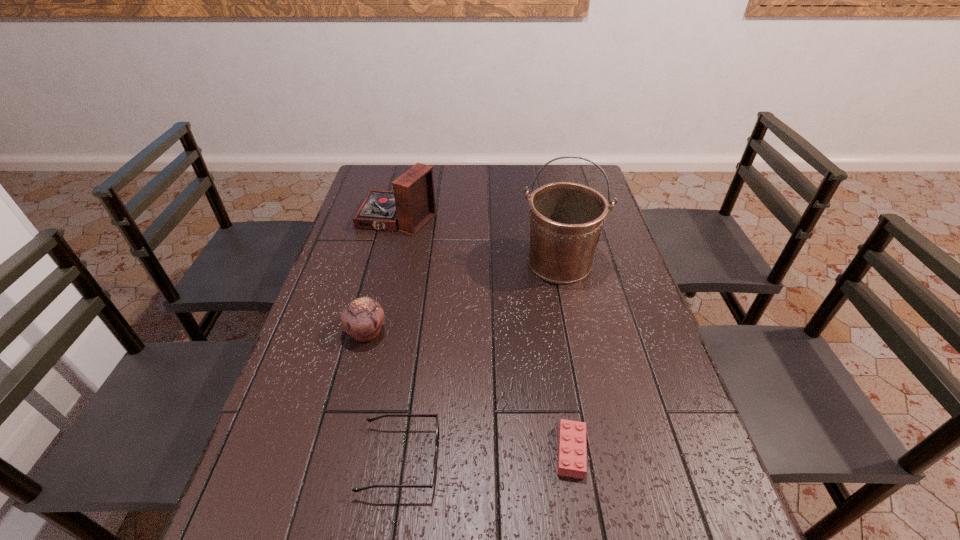
Image resolution: width=960 pixels, height=540 pixels. I want to click on free space that is in between the tallest object and the Lego, so click(x=565, y=357).

Find the location of a particular element. This screenshot has width=960, height=540. free space that is in between the sunglasses and the third tallest object is located at coordinates (383, 396).

Identify the location of free space between the third shortest object and the shortest object. Image resolution: width=960 pixels, height=540 pixels. (468, 392).

This screenshot has height=540, width=960. I want to click on vacant area that lies between the Lego and the sunglasses, so click(x=486, y=456).

The image size is (960, 540). Identify the location of free space that is in between the fourth shortest object and the Lego. pos(484,336).

At what (x,y) coordinates should I click in order to perform the action: click on free spot between the bucket and the phonograph record. Please return your answer as a coordinate pair (x, y). The height and width of the screenshot is (540, 960). Looking at the image, I should click on (478, 241).

At what (x,y) coordinates should I click in order to perform the action: click on free space between the second tallest object and the third farthest object. Please return your answer as a coordinate pair (x, y). This screenshot has width=960, height=540. Looking at the image, I should click on (382, 276).

Image resolution: width=960 pixels, height=540 pixels. Find the location of `free point between the muffin and the phonograph record`. free point between the muffin and the phonograph record is located at coordinates (382, 276).

Identify which object is the fourth closest to the shortest object. Please provide its 2D coordinates. Your answer should be formatted as a tuple, i.e. [(x, y)], where the tuple contains the x and y coordinates of a point satisfying the conditions above.

[(411, 205)]

This screenshot has width=960, height=540. In order to click on object that is the closest to the sunglasses in this screenshot , I will do `click(363, 318)`.